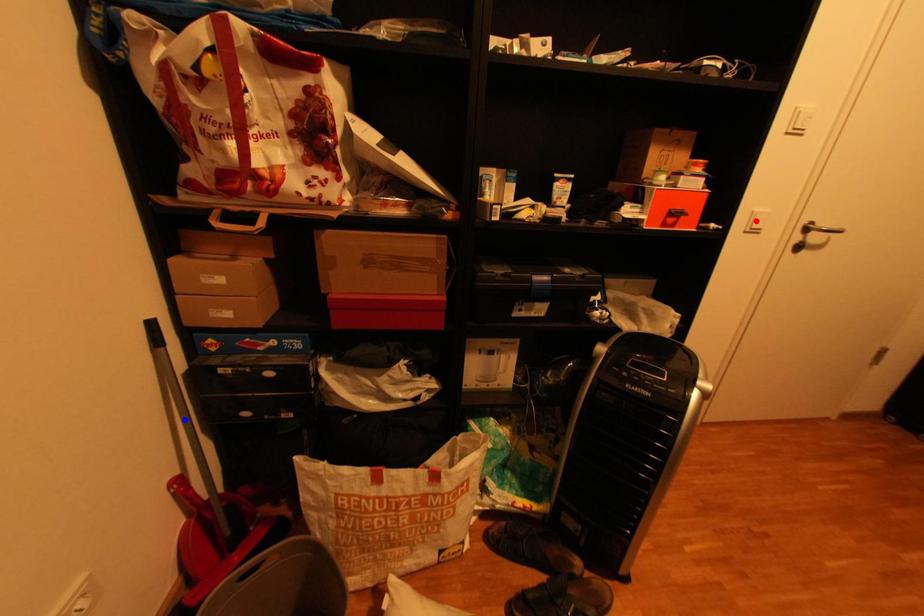
Question: Two points are marked on the image. Which point is closer to the camera?

Choices:
 (A) Blue point is closer.
 (B) Red point is closer.

Answer: (A)